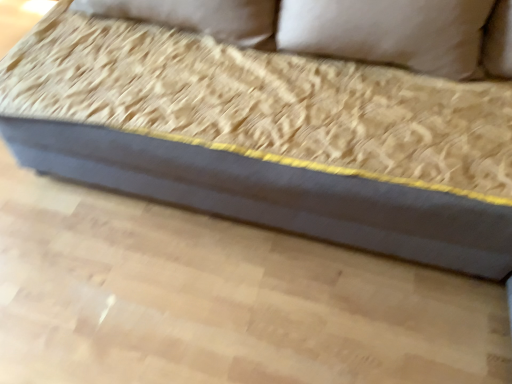
Question: Do you think beige fabric pillow at upper center is within dark gray fabric couch at center, or outside of it?

Choices:
 (A) outside
 (B) inside

Answer: (B)

Question: Considering their positions, is beige fabric pillow at upper center located in front of or behind dark gray fabric couch at center?

Choices:
 (A) front
 (B) behind

Answer: (B)

Question: From a real-world perspective, is beige fabric pillow at upper center above or below dark gray fabric couch at center?

Choices:
 (A) below
 (B) above

Answer: (B)

Question: In terms of width, does dark gray fabric couch at center look wider or thinner when compared to beige fabric pillow at upper center?

Choices:
 (A) thin
 (B) wide

Answer: (B)

Question: Based on their positions, is dark gray fabric couch at center located to the left or right of beige fabric pillow at upper center?

Choices:
 (A) left
 (B) right

Answer: (A)

Question: In terms of size, does dark gray fabric couch at center appear bigger or smaller than beige fabric pillow at upper center?

Choices:
 (A) small
 (B) big

Answer: (B)

Question: In the image, is dark gray fabric couch at center positioned in front of or behind beige fabric pillow at upper center?

Choices:
 (A) front
 (B) behind

Answer: (A)